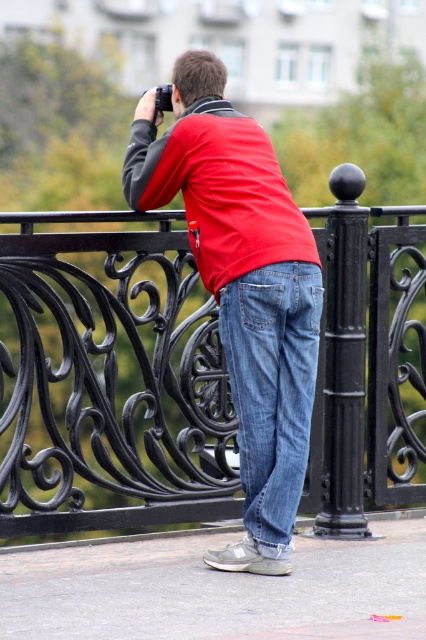
You are standing on the bridge and want to pick up an item located at point (310, 417). There is another object at point (152, 305). Which point is closer to you?

Point (152, 305) is closer to you because it is further to the camera than point (310, 417), meaning it is nearer to your position on the bridge.

You are a photographer trying to capture a clear shot of the matte red shirt at center without any obstructions. Given the presence of the black wrought iron fence at center in the scene, can you adjust your position to avoid the fence blocking the view of the shirt?

The matte red shirt at center is behind the black wrought iron fence at center, so adjusting your position might allow you to frame the shot so the fence does not block the view of the shirt.

You are a photographer trying to capture the person in the matte red shirt at center. Where should you position your camera to ensure the person is centered in your shot?

To center the matte red shirt at center in your shot, position your camera at point 0.450 on the x axis and 0.568 on the y axis, as that is the location of the matte red shirt at center.